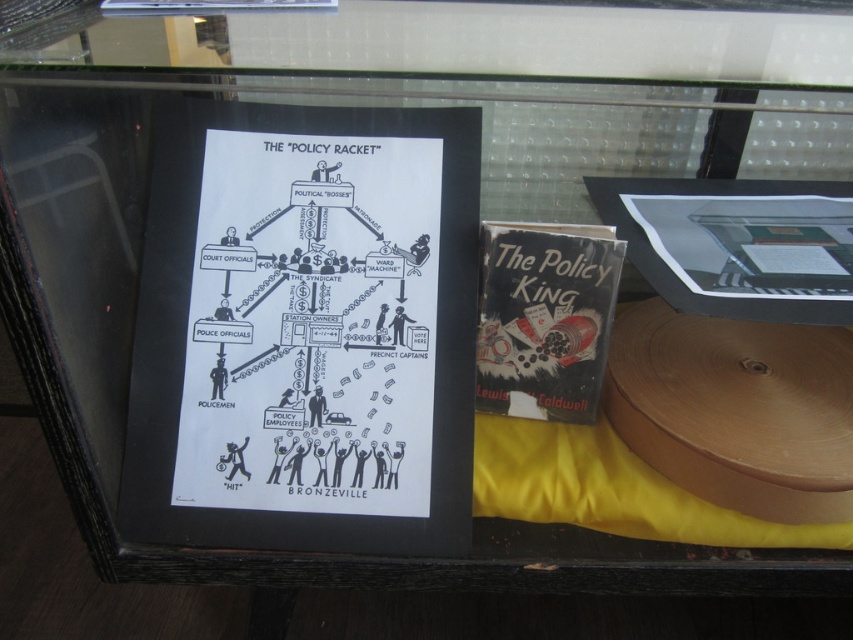
You are a visitor at a museum and you want to read the titles of both the hardcover book at upper right and the black paperback book at center. Which book should you look at first to read both titles without moving your head?

You should look at the hardcover book at upper right first because it is in front of the black paperback book at center, so its title is visible without needing to move your head.

What is the relationship between the black paper poster at center and the black paperback book at center in terms of width?

The black paper poster at center is wider than the black paperback book at center.